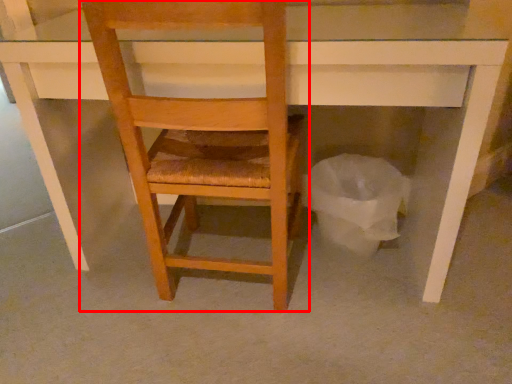
Question: From the image's perspective, where is chair (annotated by the red box) located relative to garbage?

Choices:
 (A) below
 (B) above

Answer: (B)